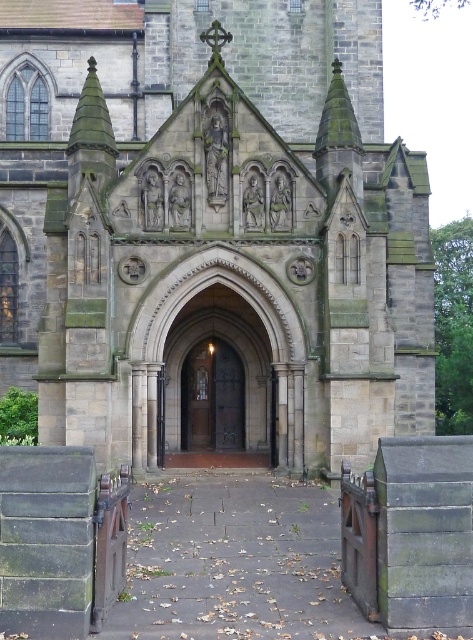
You are a visitor approaching the dark gray stone church at center and want to enter through the brown wooden door at center. Can you estimate whether the church is wider than the door?

The dark gray stone church at center is wider than the brown wooden door at center, so yes, the church is wider than the door.

You are a painter standing at the entrance of the dark gray stone church at center. You want to paint both the church and the brown wooden door at center. Which one will you need to look up more to paint?

The dark gray stone church at center has a greater height compared to the brown wooden door at center, so you will need to look up more to paint the dark gray stone church at center.

You are standing in front of the dark gray stone church at center and want to enter through the brown wooden door at center. Which direction should you move to reach the door?

The dark gray stone church at center is positioned on the left side of the brown wooden door at center, so you should move to the right to reach the door.